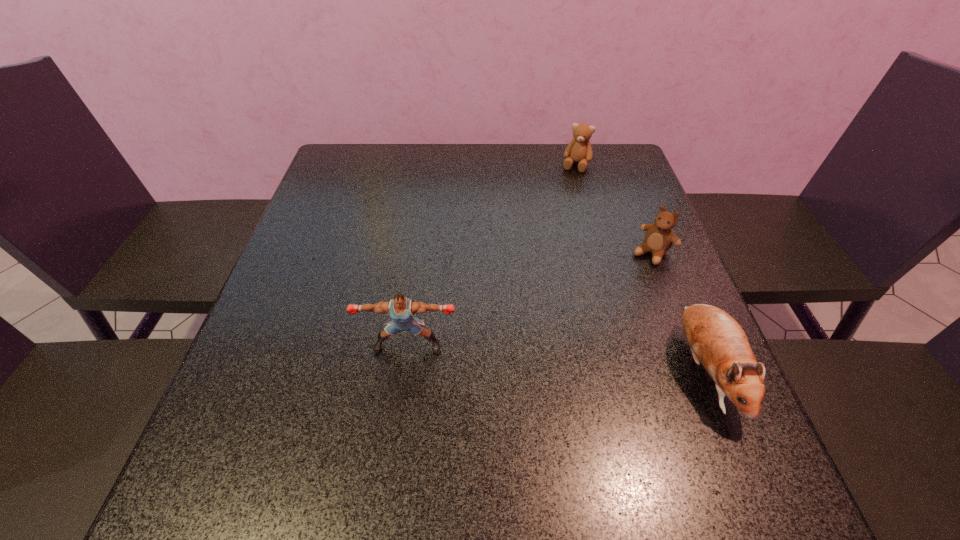
The height and width of the screenshot is (540, 960). In order to click on free space located on the front-facing side of the right teddy bear in this screenshot , I will do `click(614, 295)`.

Locate an element on the screen. The height and width of the screenshot is (540, 960). free space located 0.280m on the face of the third object from right to left is located at coordinates (552, 233).

Find the location of a particular element. Image resolution: width=960 pixels, height=540 pixels. free location located on the face of the third object from right to left is located at coordinates (547, 249).

Identify the location of free region located on the face of the third object from right to left. This screenshot has width=960, height=540. (560, 212).

At what (x,y) coordinates should I click in order to perform the action: click on object at the far edge. Please return your answer as a coordinate pair (x, y). Looking at the image, I should click on (579, 150).

Identify the location of object that is at the near edge. (716, 339).

Identify the location of hamster present at the right edge. This screenshot has height=540, width=960. (716, 339).

Find the location of a particular element. object that is at the far right corner is located at coordinates (579, 150).

In order to click on object present at the near right corner in this screenshot , I will do `click(716, 339)`.

This screenshot has height=540, width=960. I want to click on blank area at the far edge, so click(x=540, y=185).